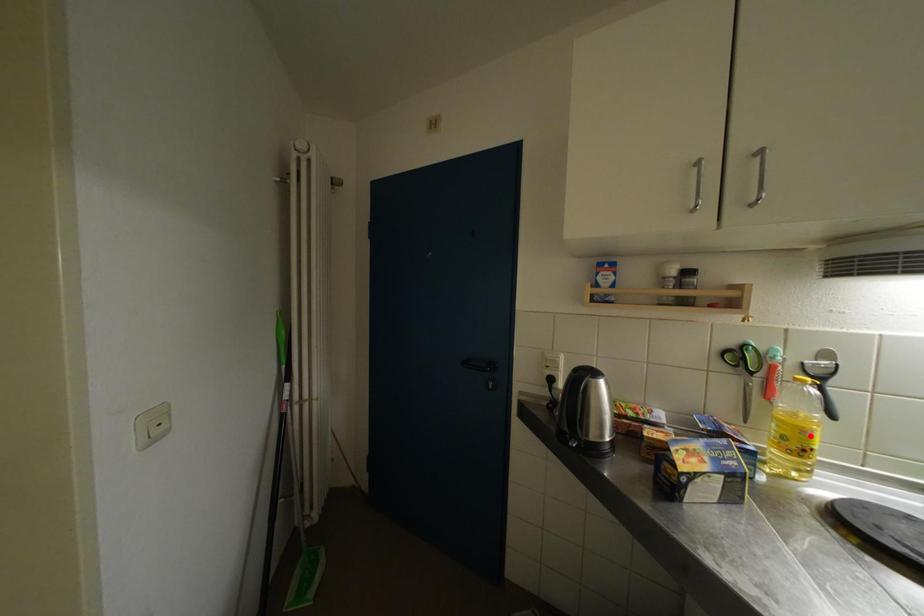
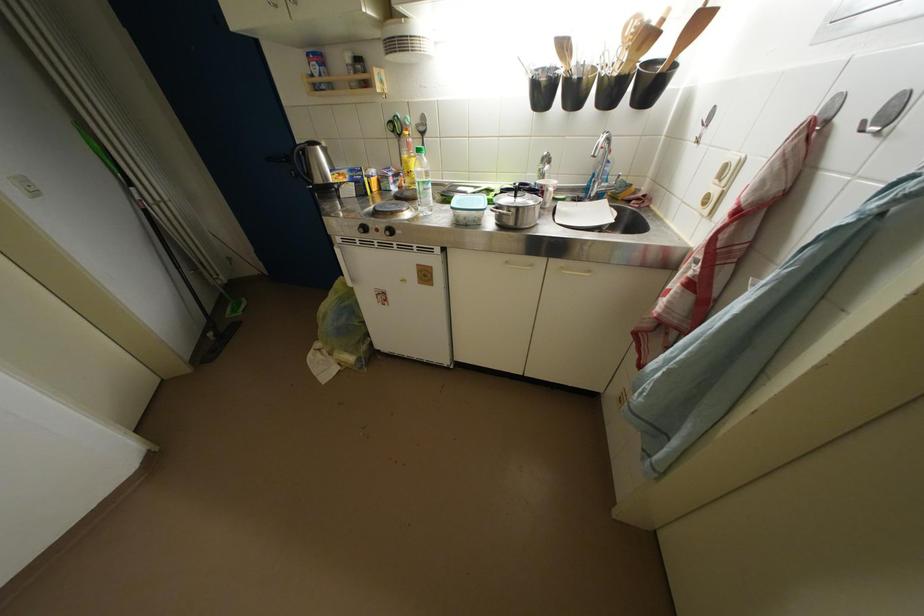
Locate, in the second image, the point that corresponds to the highlighted location in the first image.

(412, 167)